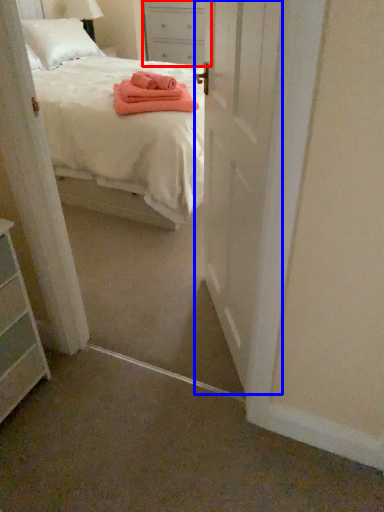
Question: Among these objects, which one is farthest to the camera, nightstand (highlighted by a red box) or door (highlighted by a blue box)?

Choices:
 (A) nightstand
 (B) door

Answer: (A)